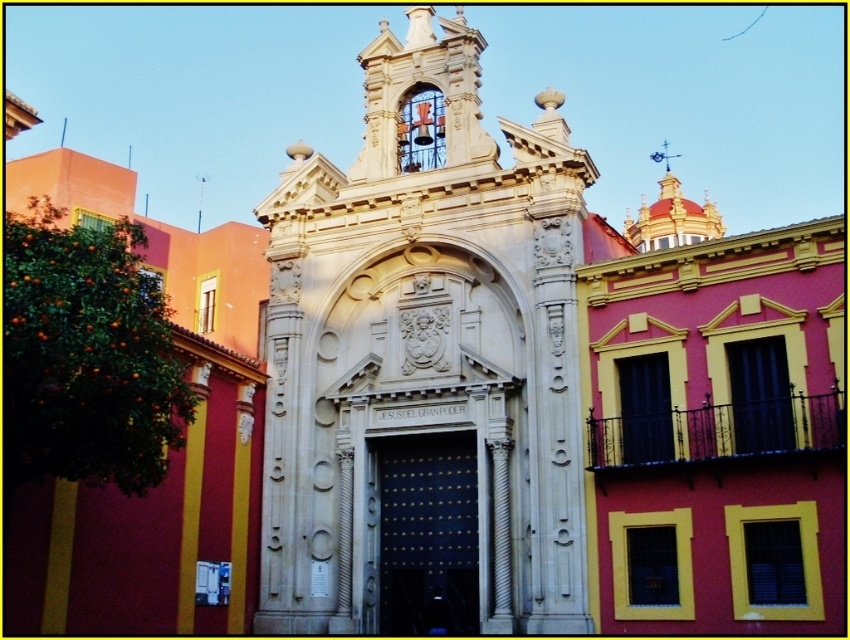
Measure the distance between point (548, 150) and camera.

A distance of 52.77 meters exists between point (548, 150) and camera.

Is white stone chapel at center above green leafy tree at left?

Indeed, white stone chapel at center is positioned over green leafy tree at left.

Where is `white stone chapel at center`? white stone chapel at center is located at coordinates (425, 353).

Locate an element on the screen. This screenshot has width=850, height=640. white stone chapel at center is located at coordinates (425, 353).